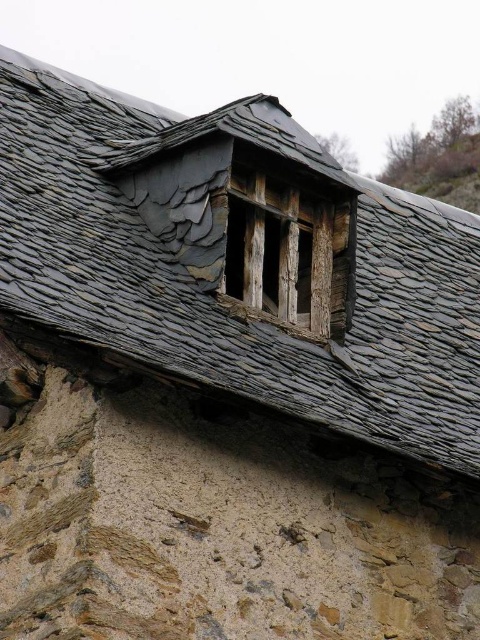
Question: Can you confirm if gray slate roof at center is positioned below weathered wood window at upper center?

Choices:
 (A) no
 (B) yes

Answer: (A)

Question: Is gray slate roof at center to the right of weathered wood window at upper center from the viewer's perspective?

Choices:
 (A) yes
 (B) no

Answer: (A)

Question: Does gray slate roof at center have a larger size compared to weathered wood window at upper center?

Choices:
 (A) yes
 (B) no

Answer: (A)